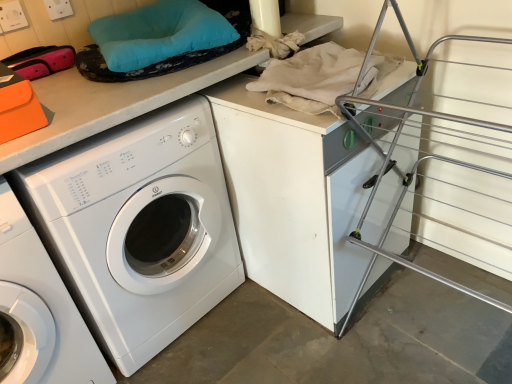
Describe the element at coordinates (39, 311) in the screenshot. I see `white glossy washing machine at center, the 1th washing machine in the left-to-right sequence` at that location.

Find the location of a particular element. The height and width of the screenshot is (384, 512). white glossy washing machine at center, the 1th washing machine in the left-to-right sequence is located at coordinates (39, 311).

The height and width of the screenshot is (384, 512). What do you see at coordinates (138, 227) in the screenshot?
I see `white glossy washing machine at center, placed as the second washing machine when sorted from left to right` at bounding box center [138, 227].

Measure the distance between white glossy washing machine at center, placed as the second washing machine when sorted from left to right, and camera.

A distance of 1.06 meters exists between white glossy washing machine at center, placed as the second washing machine when sorted from left to right, and camera.

From the picture: How much space does white glossy washing machine at center, positioned as the 1th washing machine in right-to-left order, occupy horizontally?

The width of white glossy washing machine at center, positioned as the 1th washing machine in right-to-left order, is 26.54 inches.

At what (x,y) coordinates should I click in order to perform the action: click on white glossy washing machine at center, positioned as the 1th washing machine in right-to-left order. Please return your answer as a coordinate pair (x, y). The image size is (512, 384). Looking at the image, I should click on (138, 227).

You are a GUI agent. You are given a task and a screenshot of the screen. Output one action in this format:
    pyautogui.click(x=<x>, y=<y>)
    Task: Click on the white glossy washing machine at center, acting as the second washing machine starting from the right
    
    Given the screenshot: What is the action you would take?
    pyautogui.click(x=39, y=311)

Which object is positioned more to the right, white glossy washing machine at center, acting as the second washing machine starting from the right, or white glossy washing machine at center, positioned as the 1th washing machine in right-to-left order?

white glossy washing machine at center, positioned as the 1th washing machine in right-to-left order, is more to the right.

From the picture: Does white glossy washing machine at center, the 1th washing machine in the left-to-right sequence, come in front of white glossy washing machine at center, positioned as the 1th washing machine in right-to-left order?

Yes, white glossy washing machine at center, the 1th washing machine in the left-to-right sequence, is closer to the camera.

Which is behind, point (65, 312) or point (222, 215)?

The point (222, 215) is more distant.

From the image's perspective, which one is positioned higher, white glossy washing machine at center, the 1th washing machine in the left-to-right sequence, or white glossy washing machine at center, positioned as the 1th washing machine in right-to-left order?

white glossy washing machine at center, positioned as the 1th washing machine in right-to-left order.

From the picture: From a real-world perspective, which is physically above, white glossy washing machine at center, acting as the second washing machine starting from the right, or white glossy washing machine at center, placed as the second washing machine when sorted from left to right?

From a 3D spatial view, white glossy washing machine at center, placed as the second washing machine when sorted from left to right, is above.

Considering the sizes of white glossy washing machine at center, the 1th washing machine in the left-to-right sequence, and white glossy washing machine at center, positioned as the 1th washing machine in right-to-left order, in the image, is white glossy washing machine at center, the 1th washing machine in the left-to-right sequence, wider or thinner than white glossy washing machine at center, positioned as the 1th washing machine in right-to-left order,?

Considering their sizes, white glossy washing machine at center, the 1th washing machine in the left-to-right sequence, looks slimmer than white glossy washing machine at center, positioned as the 1th washing machine in right-to-left order.

Does white glossy washing machine at center, acting as the second washing machine starting from the right, have a greater height compared to white glossy washing machine at center, placed as the second washing machine when sorted from left to right?

In fact, white glossy washing machine at center, acting as the second washing machine starting from the right, may be shorter than white glossy washing machine at center, placed as the second washing machine when sorted from left to right.

Which of these two, white glossy washing machine at center, the 1th washing machine in the left-to-right sequence, or white glossy washing machine at center, placed as the second washing machine when sorted from left to right, is bigger?

white glossy washing machine at center, placed as the second washing machine when sorted from left to right.

Is white glossy washing machine at center, acting as the second washing machine starting from the right, located outside white glossy washing machine at center, positioned as the 1th washing machine in right-to-left order?

white glossy washing machine at center, acting as the second washing machine starting from the right, lies outside white glossy washing machine at center, positioned as the 1th washing machine in right-to-left order,'s area.

Is white glossy washing machine at center, the 1th washing machine in the left-to-right sequence, directly adjacent to white glossy washing machine at center, placed as the second washing machine when sorted from left to right?

There is a gap between white glossy washing machine at center, the 1th washing machine in the left-to-right sequence, and white glossy washing machine at center, placed as the second washing machine when sorted from left to right.

Is white glossy washing machine at center, acting as the second washing machine starting from the right, facing away from white glossy washing machine at center, positioned as the 1th washing machine in right-to-left order?

white glossy washing machine at center, acting as the second washing machine starting from the right, does not have its back to white glossy washing machine at center, positioned as the 1th washing machine in right-to-left order.

How much distance is there between white glossy washing machine at center, the 1th washing machine in the left-to-right sequence, and white glossy washing machine at center, positioned as the 1th washing machine in right-to-left order?

The distance of white glossy washing machine at center, the 1th washing machine in the left-to-right sequence, from white glossy washing machine at center, positioned as the 1th washing machine in right-to-left order, is 10.14 inches.

Identify the location of washing machine on the right of white glossy washing machine at center, acting as the second washing machine starting from the right. This screenshot has height=384, width=512. (138, 227).

Looking at this image, is white glossy washing machine at center, positioned as the 1th washing machine in right-to-left order, to the left of white glossy washing machine at center, acting as the second washing machine starting from the right, from the viewer's perspective?

No, white glossy washing machine at center, positioned as the 1th washing machine in right-to-left order, is not to the left of white glossy washing machine at center, acting as the second washing machine starting from the right.

Is white glossy washing machine at center, placed as the second washing machine when sorted from left to right, closer to the viewer compared to white glossy washing machine at center, the 1th washing machine in the left-to-right sequence?

No, white glossy washing machine at center, placed as the second washing machine when sorted from left to right, is behind white glossy washing machine at center, the 1th washing machine in the left-to-right sequence.

Which is in front, point (216, 302) or point (30, 369)?

The point (30, 369) is more forward.

From the image's perspective, who appears lower, white glossy washing machine at center, positioned as the 1th washing machine in right-to-left order, or white glossy washing machine at center, acting as the second washing machine starting from the right?

white glossy washing machine at center, acting as the second washing machine starting from the right, from the image's perspective.

From a real-world perspective, relative to white glossy washing machine at center, the 1th washing machine in the left-to-right sequence, is white glossy washing machine at center, placed as the second washing machine when sorted from left to right, vertically above or below?

Clearly, from a real-world perspective, white glossy washing machine at center, placed as the second washing machine when sorted from left to right, is above white glossy washing machine at center, the 1th washing machine in the left-to-right sequence.

Considering the relative sizes of white glossy washing machine at center, placed as the second washing machine when sorted from left to right, and white glossy washing machine at center, acting as the second washing machine starting from the right, in the image provided, is white glossy washing machine at center, placed as the second washing machine when sorted from left to right, thinner than white glossy washing machine at center, acting as the second washing machine starting from the right,?

No, white glossy washing machine at center, placed as the second washing machine when sorted from left to right, is not thinner than white glossy washing machine at center, acting as the second washing machine starting from the right.

Is white glossy washing machine at center, placed as the second washing machine when sorted from left to right, taller or shorter than white glossy washing machine at center, the 1th washing machine in the left-to-right sequence?

Considering their sizes, white glossy washing machine at center, placed as the second washing machine when sorted from left to right, has more height than white glossy washing machine at center, the 1th washing machine in the left-to-right sequence.

Between white glossy washing machine at center, positioned as the 1th washing machine in right-to-left order, and white glossy washing machine at center, the 1th washing machine in the left-to-right sequence, which one has larger size?

Bigger between the two is white glossy washing machine at center, positioned as the 1th washing machine in right-to-left order.

Is white glossy washing machine at center, the 1th washing machine in the left-to-right sequence, located within white glossy washing machine at center, positioned as the 1th washing machine in right-to-left order?

No, white glossy washing machine at center, the 1th washing machine in the left-to-right sequence, is not inside white glossy washing machine at center, positioned as the 1th washing machine in right-to-left order.

Are white glossy washing machine at center, positioned as the 1th washing machine in right-to-left order, and white glossy washing machine at center, acting as the second washing machine starting from the right, far apart?

Actually, white glossy washing machine at center, positioned as the 1th washing machine in right-to-left order, and white glossy washing machine at center, acting as the second washing machine starting from the right, are a little close together.

Is white glossy washing machine at center, positioned as the 1th washing machine in right-to-left order, oriented away from white glossy washing machine at center, the 1th washing machine in the left-to-right sequence?

No.

Could you measure the distance between white glossy washing machine at center, positioned as the 1th washing machine in right-to-left order, and white glossy washing machine at center, the 1th washing machine in the left-to-right sequence?

white glossy washing machine at center, positioned as the 1th washing machine in right-to-left order, is 10.14 inches from white glossy washing machine at center, the 1th washing machine in the left-to-right sequence.

Locate an element on the screen. washing machine below the white glossy washing machine at center, positioned as the 1th washing machine in right-to-left order (from a real-world perspective) is located at coordinates (39, 311).

Where is `washing machine above the white glossy washing machine at center, acting as the second washing machine starting from the right (from a real-world perspective)`? washing machine above the white glossy washing machine at center, acting as the second washing machine starting from the right (from a real-world perspective) is located at coordinates (138, 227).

Where is `washing machine to the right of white glossy washing machine at center, the 1th washing machine in the left-to-right sequence`? The height and width of the screenshot is (384, 512). washing machine to the right of white glossy washing machine at center, the 1th washing machine in the left-to-right sequence is located at coordinates point(138,227).